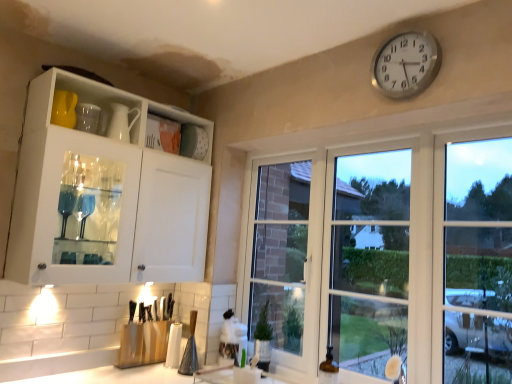
The height and width of the screenshot is (384, 512). What do you see at coordinates (384, 254) in the screenshot?
I see `clear glass windows at center` at bounding box center [384, 254].

Where is `silver metallic clock at upper right`? This screenshot has width=512, height=384. silver metallic clock at upper right is located at coordinates (406, 64).

This screenshot has height=384, width=512. Identify the location of white glossy cabinet at upper left. (105, 191).

Would you consider clear glass windows at center to be distant from white glossy cabinet at upper left?

They are positioned close to each other.

Is the position of clear glass windows at center less distant than that of white glossy cabinet at upper left?

Yes, clear glass windows at center is closer to the viewer.

Between clear glass windows at center and white glossy cabinet at upper left, which one has less height?

Standing shorter between the two is white glossy cabinet at upper left.

From the image's perspective, who appears lower, clear glass windows at center or white glossy cabinet at upper left?

clear glass windows at center is shown below in the image.

Looking at this image, could you tell me if silver metallic clock at upper right is facing clear glass windows at center?

No, silver metallic clock at upper right is not oriented towards clear glass windows at center.

This screenshot has width=512, height=384. In order to click on wall clock that appears behind the clear glass windows at center in this screenshot , I will do `click(406, 64)`.

From a real-world perspective, is silver metallic clock at upper right positioned under clear glass windows at center based on gravity?

No.

Does silver metallic clock at upper right have a lesser height compared to clear glass windows at center?

Yes.

Considering the relative positions of white glossy cabinet at upper left and clear glass windows at center in the image provided, is white glossy cabinet at upper left to the right of clear glass windows at center from the viewer's perspective?

No.

Considering the relative sizes of white glossy cabinet at upper left and clear glass windows at center in the image provided, is white glossy cabinet at upper left smaller than clear glass windows at center?

Actually, white glossy cabinet at upper left might be larger than clear glass windows at center.

Is white glossy cabinet at upper left shorter than clear glass windows at center?

Yes.

Is the depth of white glossy cabinet at upper left less than that of clear glass windows at center?

No, white glossy cabinet at upper left is further to the viewer.

Which of these two, silver metallic clock at upper right or white glossy cabinet at upper left, is smaller?

With smaller size is silver metallic clock at upper right.

From the image's perspective, which one is positioned lower, silver metallic clock at upper right or white glossy cabinet at upper left?

From the image's view, white glossy cabinet at upper left is below.

Is silver metallic clock at upper right surrounding white glossy cabinet at upper left?

Actually, white glossy cabinet at upper left is outside silver metallic clock at upper right.

Is silver metallic clock at upper right to the right of white glossy cabinet at upper left from the viewer's perspective?

Correct, you'll find silver metallic clock at upper right to the right of white glossy cabinet at upper left.

Is white glossy cabinet at upper left not close to silver metallic clock at upper right?

That's right, there is a large distance between white glossy cabinet at upper left and silver metallic clock at upper right.

Is white glossy cabinet at upper left inside the boundaries of silver metallic clock at upper right, or outside?

white glossy cabinet at upper left is not enclosed by silver metallic clock at upper right.

Looking at this image, which is more to the left, white glossy cabinet at upper left or silver metallic clock at upper right?

Positioned to the left is white glossy cabinet at upper left.

Considering the positions of objects clear glass windows at center and silver metallic clock at upper right in the image provided, who is more to the left, clear glass windows at center or silver metallic clock at upper right?

From the viewer's perspective, clear glass windows at center appears more on the left side.

Can you tell me how much clear glass windows at center and silver metallic clock at upper right differ in facing direction?

The angular difference between clear glass windows at center and silver metallic clock at upper right is 0.48 degrees.

Is clear glass windows at center not close to silver metallic clock at upper right?

No, there isn't a large distance between clear glass windows at center and silver metallic clock at upper right.

From the image's perspective, is clear glass windows at center above or below silver metallic clock at upper right?

clear glass windows at center is situated lower than silver metallic clock at upper right in the image.

What are the coordinates of `cabinetry behind the clear glass windows at center` in the screenshot? It's located at (105, 191).

The width and height of the screenshot is (512, 384). What are the coordinates of `window below the silver metallic clock at upper right (from a real-world perspective)` in the screenshot? It's located at (384, 254).

When comparing their distances from silver metallic clock at upper right, does white glossy cabinet at upper left or clear glass windows at center seem closer?

The object closer to silver metallic clock at upper right is clear glass windows at center.

When comparing their distances from white glossy cabinet at upper left, does clear glass windows at center or silver metallic clock at upper right seem further?

silver metallic clock at upper right is positioned further to the anchor white glossy cabinet at upper left.

In the scene shown: Considering their positions, is white glossy cabinet at upper left positioned further to clear glass windows at center than silver metallic clock at upper right?

white glossy cabinet at upper left.

In the scene shown: Looking at the image, which one is located closer to silver metallic clock at upper right, clear glass windows at center or white glossy cabinet at upper left?

A: The object closer to silver metallic clock at upper right is clear glass windows at center.

Based on the photo, when comparing their distances from white glossy cabinet at upper left, does silver metallic clock at upper right or clear glass windows at center seem further?

The object further to white glossy cabinet at upper left is silver metallic clock at upper right.

When comparing their distances from clear glass windows at center, does silver metallic clock at upper right or white glossy cabinet at upper left seem closer?

silver metallic clock at upper right is positioned closer to the anchor clear glass windows at center.

At what (x,y) coordinates should I click in order to perform the action: click on window situated between white glossy cabinet at upper left and silver metallic clock at upper right from left to right. Please return your answer as a coordinate pair (x, y). Looking at the image, I should click on (384, 254).